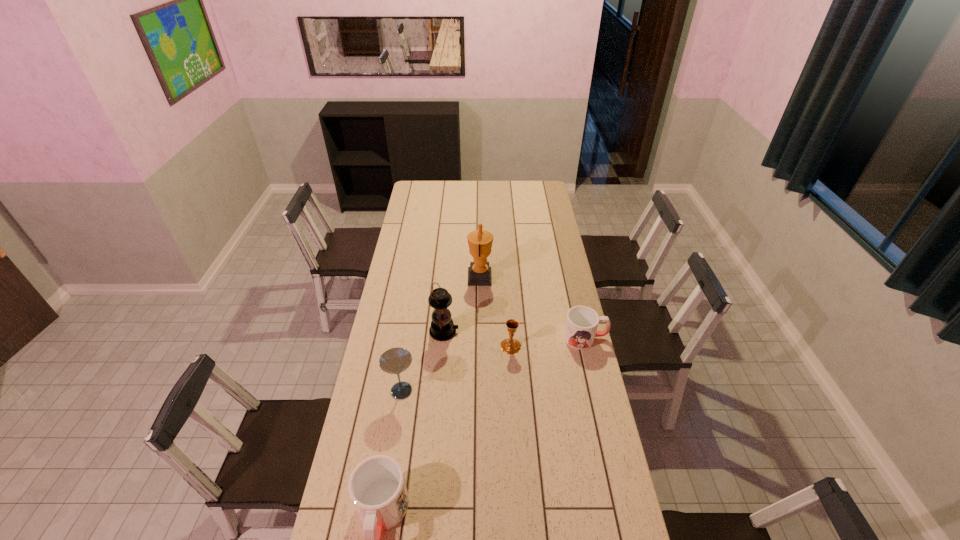
At what (x,y) coordinates should I click in order to perform the action: click on free spot located 0.330m at the front of the third object from right to left with handles. Please return your answer as a coordinate pair (x, y). Looking at the image, I should click on (402, 277).

The height and width of the screenshot is (540, 960). What are the coordinates of `vacant area located 0.270m on the front of the martini` in the screenshot? It's located at (388, 475).

Locate several spots in free space located 0.150m above the lantern, indicating its light source. Please provide its 2D coordinates. Your answer should be formatted as a tuple, i.e. [(x, y)], where the tuple contains the x and y coordinates of a point satisfying the conditions above.

[(492, 332)]

Image resolution: width=960 pixels, height=540 pixels. I want to click on vacant point located on the right of the chalice, so click(536, 346).

Identify the location of object present at the left edge. The image size is (960, 540). (395, 360).

Find the location of a particular element. object situated at the right edge is located at coordinates (582, 322).

In the image, there is a desktop. Identify the location of vacant space at the far edge. This screenshot has height=540, width=960. (484, 184).

In the image, there is a desktop. Where is `free region at the near edge`? The image size is (960, 540). free region at the near edge is located at coordinates (571, 516).

The height and width of the screenshot is (540, 960). In the image, there is a desktop. In order to click on free space at the left edge in this screenshot , I will do `click(408, 222)`.

At what (x,y) coordinates should I click in order to perform the action: click on free region at the right edge. Please return your answer as a coordinate pair (x, y). Looking at the image, I should click on (540, 247).